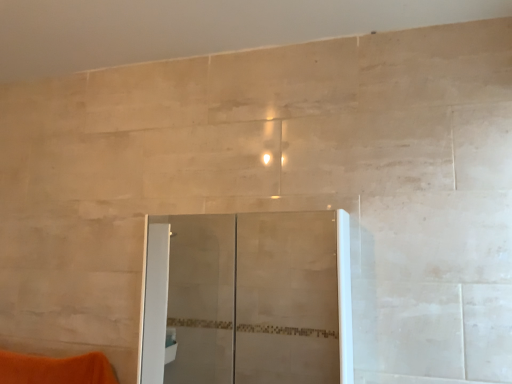
Describe the element at coordinates (248, 299) in the screenshot. I see `transparent glass door at center` at that location.

Identify the location of transparent glass door at center. The width and height of the screenshot is (512, 384). (248, 299).

Identify the location of transparent glass door at center. This screenshot has width=512, height=384. (248, 299).